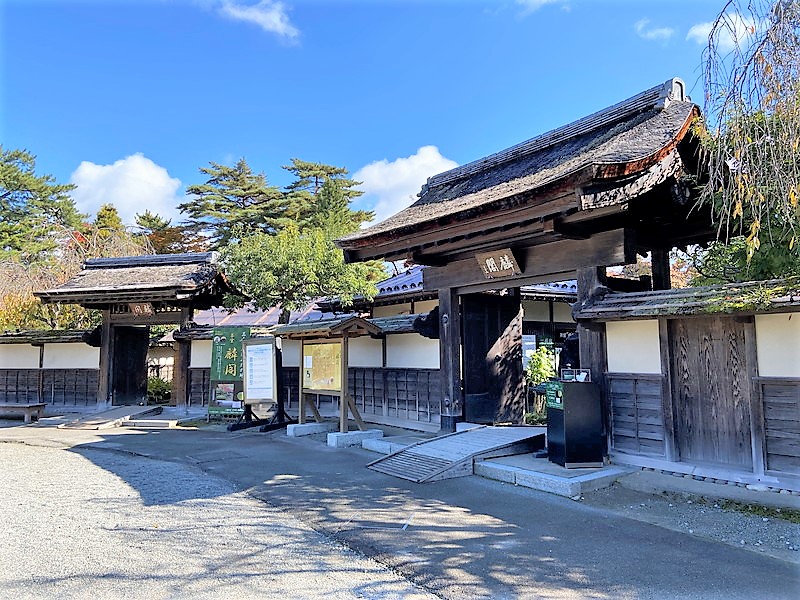
The image size is (800, 600). In order to click on entryways in this screenshot , I will do `click(554, 363)`, `click(160, 363)`.